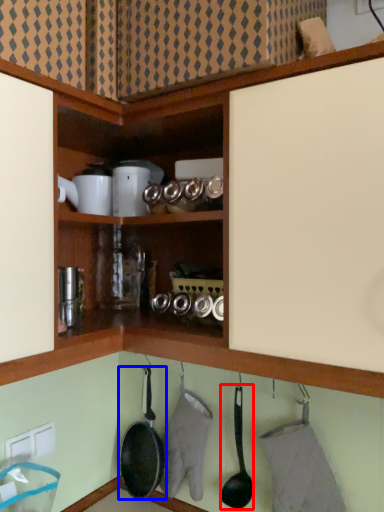
Question: Which of the following is the farthest to the observer, frying pan (highlighted by a red box) or frying pan (highlighted by a blue box)?

Choices:
 (A) frying pan
 (B) frying pan

Answer: (B)